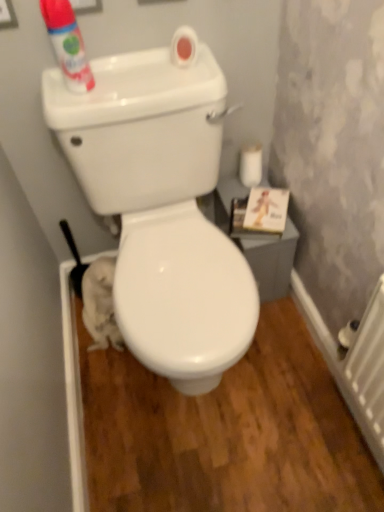
What is the approximate height of matte white can at upper left?

matte white can at upper left is 8.37 inches tall.

The width and height of the screenshot is (384, 512). I want to click on white matte toilet paper at right, so click(x=250, y=164).

I want to click on matte white can at upper left, so click(67, 44).

Can white matte toilet paper at right be found inside white plastic radiator at lower right?

Definitely not — white matte toilet paper at right is not inside white plastic radiator at lower right.

Are white plastic radiator at lower right and white matte toilet paper at right far apart?

No, white plastic radiator at lower right is not far away from white matte toilet paper at right.

Is white plastic radiator at lower right in front of white matte toilet paper at right?

Yes, it is in front of white matte toilet paper at right.

Is white plastic radiator at lower right facing away from white matte toilet paper at right?

No, white plastic radiator at lower right's orientation is not away from white matte toilet paper at right.

Is point (251, 176) positioned after point (72, 81)?

Yes, it is.

Does white matte toilet paper at right lie in front of matte white can at upper left?

No.

The height and width of the screenshot is (512, 384). In order to click on toilet paper on the right side of matte white can at upper left in this screenshot , I will do `click(250, 164)`.

From a real-world perspective, is white matte toilet paper at right over matte white can at upper left?

No, from a real-world perspective, white matte toilet paper at right is not over matte white can at upper left

Which of these two, white glossy toilet at center or matte white can at upper left, is thinner?

matte white can at upper left is thinner.

From the image's perspective, would you say white glossy toilet at center is positioned over matte white can at upper left?

No, from the image's perspective, white glossy toilet at center is not above matte white can at upper left.

Which is behind, white glossy toilet at center or matte white can at upper left?

matte white can at upper left.

Does white matte toilet paper at right turn towards white glossy toilet at center?

No, white matte toilet paper at right is not aimed at white glossy toilet at center.

At what (x,y) coordinates should I click in order to perform the action: click on toilet that appears below the white matte toilet paper at right (from the image's perspective). Please return your answer as a coordinate pair (x, y). Looking at the image, I should click on (161, 205).

Between point (250, 170) and point (136, 100), which one is positioned behind?

The point (250, 170) is farther.

Is white matte toilet paper at right not inside white glossy toilet at center?

Yes, white matte toilet paper at right is outside of white glossy toilet at center.

Which is in front, point (99, 166) or point (376, 317)?

The point (376, 317) is in front.

Identify the location of toilet positioned vertically above the white plastic radiator at lower right (from a real-world perspective). This screenshot has width=384, height=512. (161, 205).

Does white glossy toilet at center have a lesser height compared to white plastic radiator at lower right?

No.

Looking at this image, considering the sizes of matte white can at upper left and white plastic radiator at lower right in the image, is matte white can at upper left bigger or smaller than white plastic radiator at lower right?

Considering their sizes, matte white can at upper left takes up less space than white plastic radiator at lower right.

Which is closer to the camera, (71, 58) or (368, 381)?

Point (71, 58) is farther from the camera than point (368, 381).

From the image's perspective, is matte white can at upper left located beneath white plastic radiator at lower right?

Incorrect, from the image's perspective, matte white can at upper left is higher than white plastic radiator at lower right.

Is matte white can at upper left aimed at white plastic radiator at lower right?

No.

Which is in front, point (370, 336) or point (83, 153)?

The point (370, 336) is more forward.

Does white plastic radiator at lower right touch white glossy toilet at center?

white plastic radiator at lower right is not next to white glossy toilet at center, and they're not touching.

From a real-world perspective, which object stands above the other?

white glossy toilet at center.

In terms of height, does white plastic radiator at lower right look taller or shorter compared to white glossy toilet at center?

Clearly, white plastic radiator at lower right is shorter compared to white glossy toilet at center.

Locate an element on the screen. radiator on the right side of white matte toilet paper at right is located at coordinates (368, 374).

Locate an element on the screen. This screenshot has height=512, width=384. cleaning product lying on the left of white matte toilet paper at right is located at coordinates (67, 44).

When comparing their distances from white glossy toilet at center, does matte white can at upper left or white matte toilet paper at right seem closer?

matte white can at upper left.

Based on their spatial positions, is white matte toilet paper at right or white plastic radiator at lower right closer to white glossy toilet at center?

white matte toilet paper at right lies closer to white glossy toilet at center than the other object.

From the image, which object appears to be nearer to white plastic radiator at lower right, white glossy toilet at center or white matte toilet paper at right?

white glossy toilet at center is closer to white plastic radiator at lower right.

Based on their spatial positions, is matte white can at upper left or white plastic radiator at lower right further from white matte toilet paper at right?

Among the two, white plastic radiator at lower right is located further to white matte toilet paper at right.

Based on their spatial positions, is white plastic radiator at lower right or matte white can at upper left closer to white glossy toilet at center?

matte white can at upper left is positioned closer to the anchor white glossy toilet at center.

In the scene shown: Looking at the image, which one is located further to white glossy toilet at center, matte white can at upper left or white plastic radiator at lower right?

white plastic radiator at lower right.

Based on their spatial positions, is white matte toilet paper at right or white glossy toilet at center closer to matte white can at upper left?

white glossy toilet at center is closer to matte white can at upper left.

When comparing their distances from white matte toilet paper at right, does white glossy toilet at center or white plastic radiator at lower right seem further?

white plastic radiator at lower right.

Find the location of a particular element. The height and width of the screenshot is (512, 384). toilet located between white plastic radiator at lower right and white matte toilet paper at right in the depth direction is located at coordinates (161, 205).

Where is `cleaning product between white glossy toilet at center and white matte toilet paper at right in the front-back direction`? The image size is (384, 512). cleaning product between white glossy toilet at center and white matte toilet paper at right in the front-back direction is located at coordinates (67, 44).

This screenshot has width=384, height=512. Find the location of `toilet paper between matte white can at upper left and white plastic radiator at lower right in the vertical direction`. toilet paper between matte white can at upper left and white plastic radiator at lower right in the vertical direction is located at coordinates (250, 164).

The image size is (384, 512). In order to click on toilet between matte white can at upper left and white plastic radiator at lower right in this screenshot , I will do `click(161, 205)`.